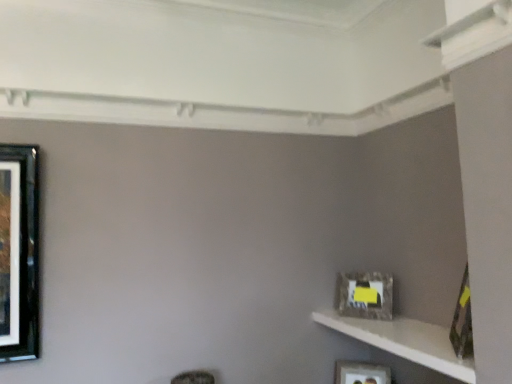
Question: From the image's perspective, is white textured shelf at lower right located above camouflage-patterned frame at right, which is the third picture frame in bottom-to-top order?

Choices:
 (A) yes
 (B) no

Answer: (B)

Question: From a real-world perspective, does white textured shelf at lower right sit lower than camouflage-patterned frame at right, which is counted as the first picture frame, starting from the top?

Choices:
 (A) yes
 (B) no

Answer: (A)

Question: Does white textured shelf at lower right appear on the left side of camouflage-patterned frame at right, which is the third picture frame in bottom-to-top order?

Choices:
 (A) yes
 (B) no

Answer: (A)

Question: Considering the relative positions of white textured shelf at lower right and camouflage-patterned frame at right, the 1th picture frame when ordered from front to back, in the image provided, is white textured shelf at lower right behind camouflage-patterned frame at right, the 1th picture frame when ordered from front to back,?

Choices:
 (A) no
 (B) yes

Answer: (A)

Question: From a real-world perspective, is white textured shelf at lower right located higher than camouflage-patterned frame at right, the 1th picture frame when ordered from front to back?

Choices:
 (A) yes
 (B) no

Answer: (B)

Question: Does point (340, 365) appear closer or farther from the camera than point (344, 283)?

Choices:
 (A) closer
 (B) farther

Answer: (B)

Question: Visually, is matte black picture frame at lower right, which is the third picture frame from front to back, positioned to the left or to the right of matte gray frame at right, placed as the 2th picture frame when sorted from front to back?

Choices:
 (A) right
 (B) left

Answer: (B)

Question: Is matte black picture frame at lower right, the 1th picture frame in the back-to-front sequence, inside or outside of matte gray frame at right, placed as the 2th picture frame when sorted from front to back?

Choices:
 (A) outside
 (B) inside

Answer: (A)

Question: Based on their sizes in the image, would you say matte black picture frame at lower right, acting as the third picture frame starting from the top, is bigger or smaller than matte gray frame at right, the 2th picture frame from the bottom?

Choices:
 (A) small
 (B) big

Answer: (A)

Question: From the image's perspective, relative to white textured shelf at lower right, is camouflage-patterned frame at right, which is the third picture frame in bottom-to-top order, above or below?

Choices:
 (A) above
 (B) below

Answer: (A)

Question: Does point (467, 316) appear closer or farther from the camera than point (400, 334)?

Choices:
 (A) farther
 (B) closer

Answer: (B)

Question: Considering their positions, is camouflage-patterned frame at right, which is the third picture frame in bottom-to-top order, located in front of or behind white textured shelf at lower right?

Choices:
 (A) behind
 (B) front

Answer: (A)

Question: Is camouflage-patterned frame at right, placed as the third picture frame when sorted from back to front, taller or shorter than white textured shelf at lower right?

Choices:
 (A) short
 (B) tall

Answer: (B)

Question: From the image's perspective, is white textured shelf at lower right positioned above or below matte gray frame at right, the 2th picture frame from the bottom?

Choices:
 (A) below
 (B) above

Answer: (A)

Question: Is white textured shelf at lower right inside or outside of matte gray frame at right, the 2th picture frame from the bottom?

Choices:
 (A) outside
 (B) inside

Answer: (A)